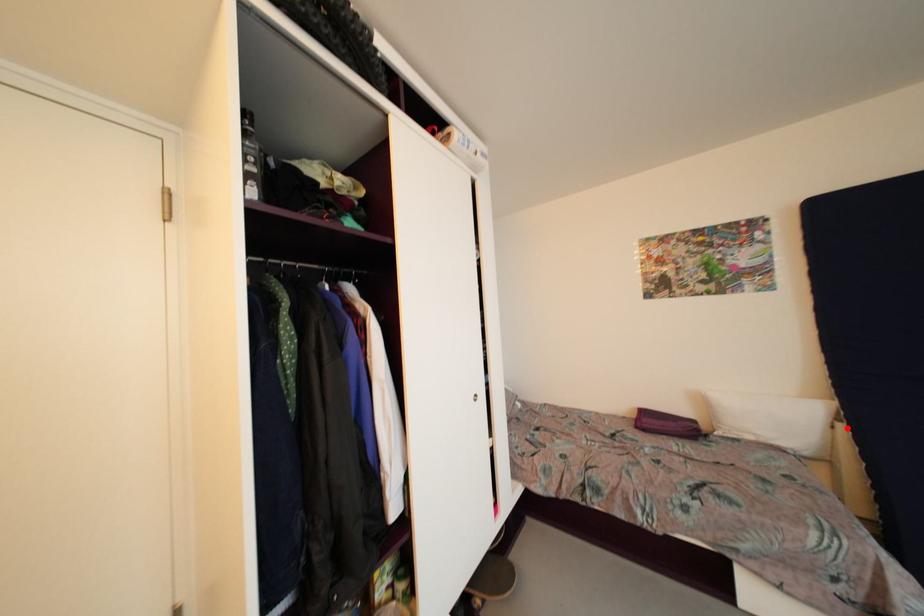
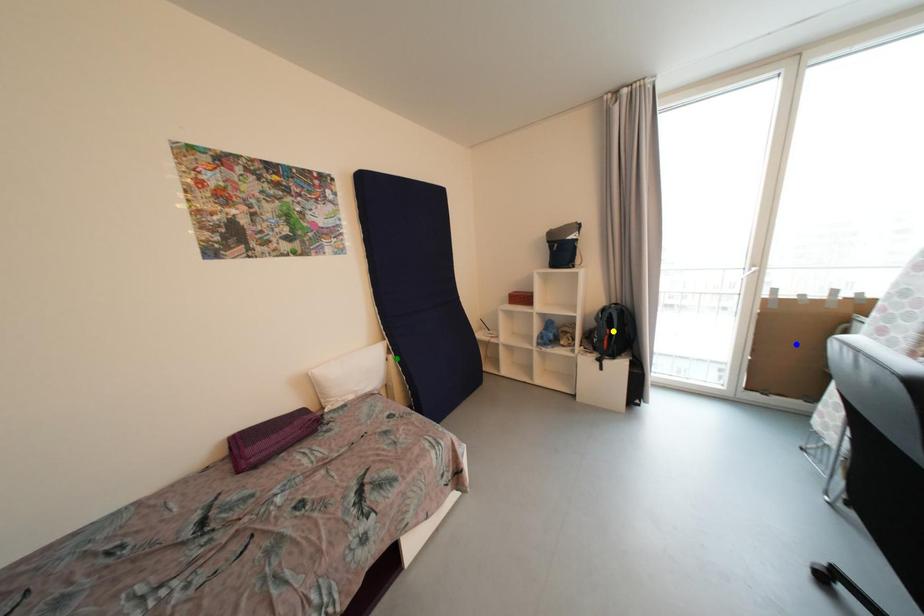
Question: I am providing you with two images of the same scene from different viewpoints. A red point is marked on the first image. You are given multiple points on the second image. Which point in image 2 is actually the same real-world point as the red point in image 1?

Choices:
 (A) yellow point
 (B) green point
 (C) blue point

Answer: (B)